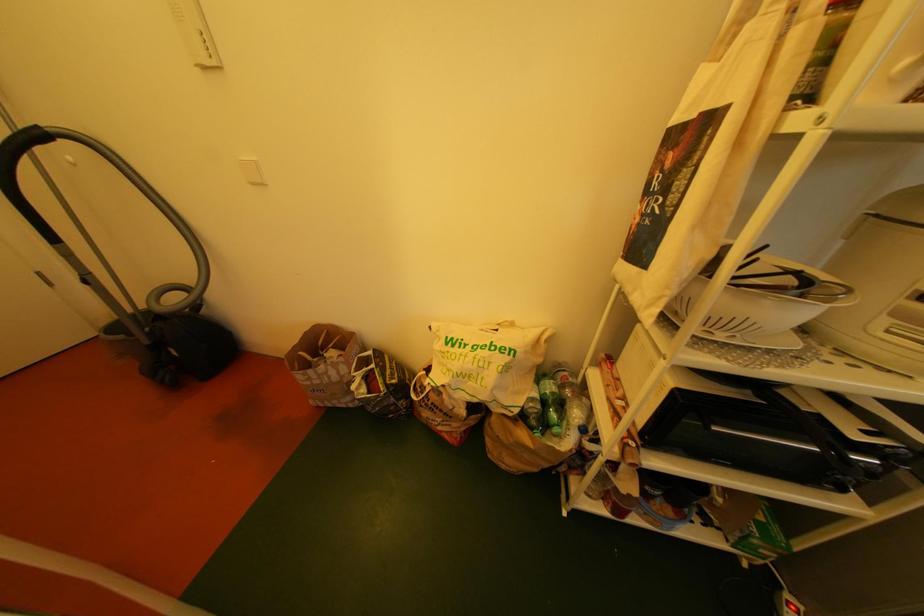
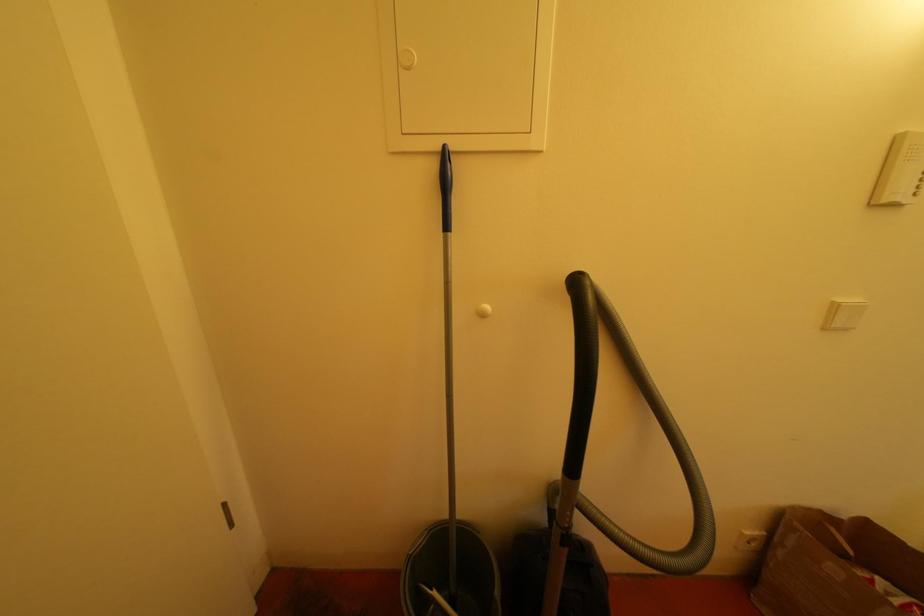
Question: In a continuous first-person perspective shot, in which direction is the camera moving?

Choices:
 (A) Left
 (B) Right
 (C) Forward
 (D) Backward

Answer: (A)